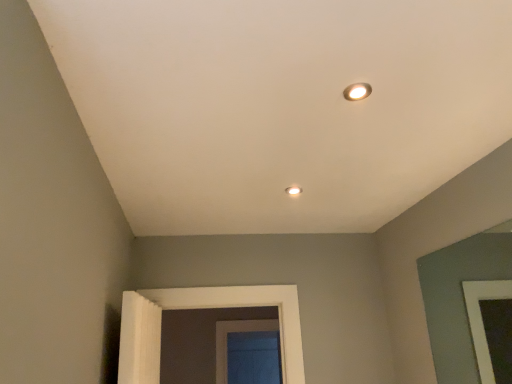
The image size is (512, 384). I want to click on matte white recessed light at upper right, so click(x=357, y=91).

The width and height of the screenshot is (512, 384). Describe the element at coordinates (357, 91) in the screenshot. I see `matte white recessed light at upper right` at that location.

What do you see at coordinates (293, 190) in the screenshot?
I see `matte white lamp at upper center` at bounding box center [293, 190].

The height and width of the screenshot is (384, 512). In order to click on matte white lamp at upper center in this screenshot , I will do `click(293, 190)`.

Measure the distance between point (295, 188) and camera.

Point (295, 188) is 2.00 meters from camera.

You are a GUI agent. You are given a task and a screenshot of the screen. Output one action in this format:
    pyautogui.click(x=<x>, y=<y>)
    Task: Click on the matte white recessed light at upper right
    The width and height of the screenshot is (512, 384).
    Given the screenshot: What is the action you would take?
    pyautogui.click(x=357, y=91)

Does matte white recessed light at upper right appear on the left side of matte white lamp at upper center?

In fact, matte white recessed light at upper right is to the right of matte white lamp at upper center.

Is matte white recessed light at upper right further to the viewer compared to matte white lamp at upper center?

No, matte white recessed light at upper right is in front of matte white lamp at upper center.

Which is less distant, (361,98) or (298,190)?

Point (361,98) appears to be closer to the viewer than point (298,190).

In the scene shown: From the image's perspective, which one is positioned higher, matte white recessed light at upper right or matte white lamp at upper center?

matte white recessed light at upper right appears higher in the image.

From the picture: From a real-world perspective, is matte white recessed light at upper right physically above matte white lamp at upper center?

Indeed, from a real-world perspective, matte white recessed light at upper right stands above matte white lamp at upper center.

In the scene shown: Considering the relative sizes of matte white recessed light at upper right and matte white lamp at upper center in the image provided, is matte white recessed light at upper right wider than matte white lamp at upper center?

No, matte white recessed light at upper right is not wider than matte white lamp at upper center.

In terms of height, does matte white recessed light at upper right look taller or shorter compared to matte white lamp at upper center?

matte white recessed light at upper right is taller than matte white lamp at upper center.

Who is smaller, matte white recessed light at upper right or matte white lamp at upper center?

matte white lamp at upper center is smaller.

Is matte white recessed light at upper right positioned beyond the bounds of matte white lamp at upper center?

Yes.

Are matte white recessed light at upper right and matte white lamp at upper center located far from each other?

No, there isn't a large distance between matte white recessed light at upper right and matte white lamp at upper center.

Is matte white recessed light at upper right positioned with its back to matte white lamp at upper center?

Yes, matte white lamp at upper center is at the back of matte white recessed light at upper right.

Can you tell me how much matte white recessed light at upper right and matte white lamp at upper center differ in facing direction?

The facing directions of matte white recessed light at upper right and matte white lamp at upper center are 0.00354 degrees apart.

The image size is (512, 384). In order to click on lamp behind the matte white recessed light at upper right in this screenshot , I will do `click(293, 190)`.

Is matte white lamp at upper center to the left of matte white recessed light at upper right from the viewer's perspective?

Yes, matte white lamp at upper center is to the left of matte white recessed light at upper right.

Considering the relative positions of matte white lamp at upper center and matte white recessed light at upper right in the image provided, is matte white lamp at upper center in front of matte white recessed light at upper right?

No, matte white lamp at upper center is further to the viewer.

Is point (296, 193) positioned in front of point (358, 91)?

No, it is behind (358, 91).

From the image's perspective, which is below, matte white lamp at upper center or matte white recessed light at upper right?

matte white lamp at upper center appears lower in the image.

From a real-world perspective, relative to matte white recessed light at upper right, is matte white lamp at upper center vertically above or below?

In terms of real-world spatial position, matte white lamp at upper center is below matte white recessed light at upper right.

Does matte white lamp at upper center have a lesser width compared to matte white recessed light at upper right?

Incorrect, the width of matte white lamp at upper center is not less than that of matte white recessed light at upper right.

Who is taller, matte white lamp at upper center or matte white recessed light at upper right?

matte white recessed light at upper right is taller.

Who is bigger, matte white lamp at upper center or matte white recessed light at upper right?

Bigger between the two is matte white recessed light at upper right.

Would you say matte white lamp at upper center is outside matte white recessed light at upper right?

Yes, matte white lamp at upper center is outside of matte white recessed light at upper right.

Is matte white lamp at upper center placed right next to matte white recessed light at upper right?

No, matte white lamp at upper center is not beside matte white recessed light at upper right.

In the scene shown: Is matte white lamp at upper center positioned with its back to matte white recessed light at upper right?

No, matte white recessed light at upper right is not at the back of matte white lamp at upper center.

How different are the orientations of matte white lamp at upper center and matte white recessed light at upper right in degrees?

The facing directions of matte white lamp at upper center and matte white recessed light at upper right are 0.00354 degrees apart.

The width and height of the screenshot is (512, 384). What are the coordinates of `lamp below the matte white recessed light at upper right (from a real-world perspective)` in the screenshot? It's located at (293, 190).

Find the location of a particular element. This screenshot has height=384, width=512. light located above the matte white lamp at upper center (from the image's perspective) is located at coordinates (357, 91).

Locate an element on the screen. The height and width of the screenshot is (384, 512). lamp behind the matte white recessed light at upper right is located at coordinates 293,190.